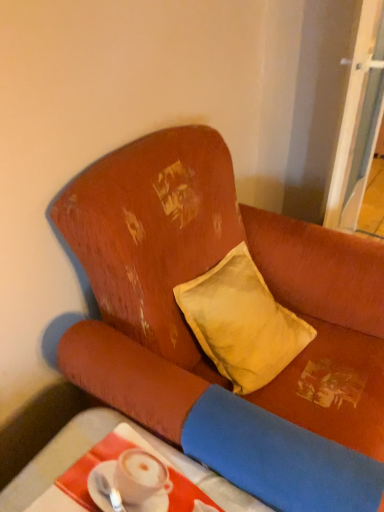
Question: Looking at their shapes, would you say distressed orange fabric couch at upper left is wider or thinner than white glossy spoon at lower left?

Choices:
 (A) thin
 (B) wide

Answer: (B)

Question: Is distressed orange fabric couch at upper left situated inside white glossy spoon at lower left or outside?

Choices:
 (A) inside
 (B) outside

Answer: (B)

Question: Which object is positioned farthest from the white glossy spoon at lower left?

Choices:
 (A) smooth white table at lower left
 (B) distressed orange fabric couch at upper left
 (C) transparent glass screen door at upper right
 (D) yellow fabric pillow at center

Answer: (C)

Question: Which object is the farthest from the transparent glass screen door at upper right?

Choices:
 (A) white glossy spoon at lower left
 (B) yellow fabric pillow at center
 (C) smooth white table at lower left
 (D) distressed orange fabric couch at upper left

Answer: (A)